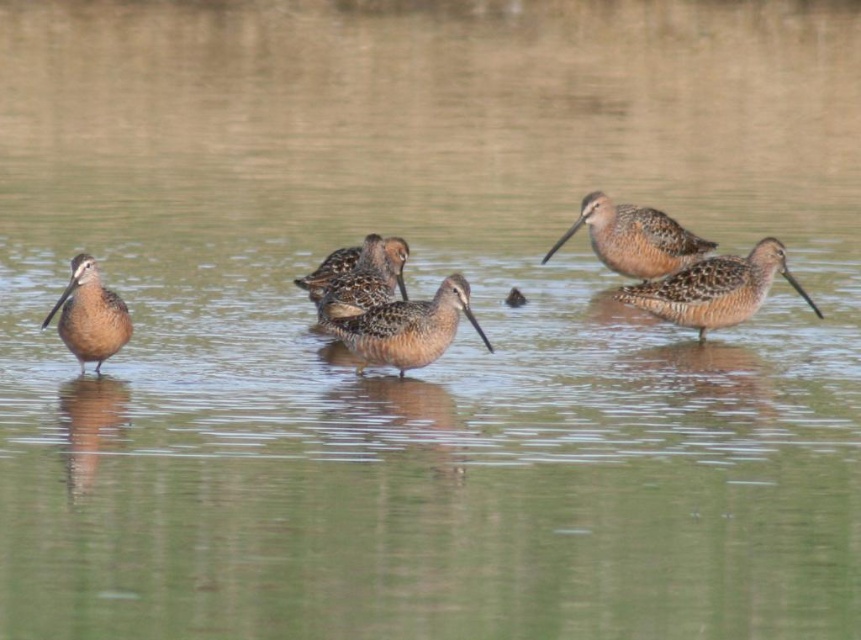
Question: Is brown speckled feathers at right to the right of brown feathered bird at upper right from the viewer's perspective?

Choices:
 (A) no
 (B) yes

Answer: (B)

Question: Is brown matte bird at center below brown speckled bird at left?

Choices:
 (A) yes
 (B) no

Answer: (B)

Question: Can you confirm if brown matte bird at center is wider than brown speckled feathers at center?

Choices:
 (A) yes
 (B) no

Answer: (A)

Question: Which object appears closest to the camera in this image?

Choices:
 (A) brown speckled bird at left
 (B) brown speckled feathers at right
 (C) brown feathered bird at upper right
 (D) brown matte bird at center

Answer: (A)

Question: Which point is farther from the camera taking this photo?

Choices:
 (A) (691, 236)
 (B) (360, 326)
 (C) (344, 307)
 (D) (760, 275)

Answer: (A)

Question: Which point is farther to the camera?

Choices:
 (A) brown speckled feathers at center
 (B) brown speckled bird at left
 (C) brown matte bird at center

Answer: (A)